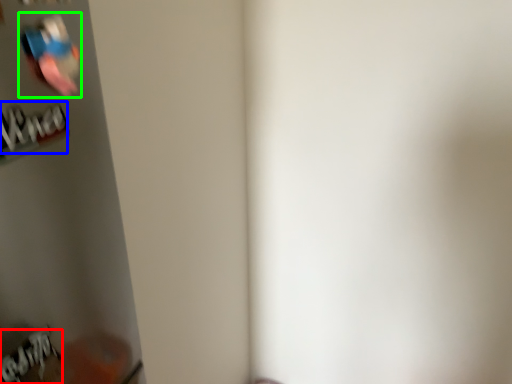
Question: Which object is the closest to the writing (highlighted by a red box)? Choose among these: writing (highlighted by a blue box) or Wii controller (highlighted by a green box).

Choices:
 (A) writing
 (B) Wii controller

Answer: (A)